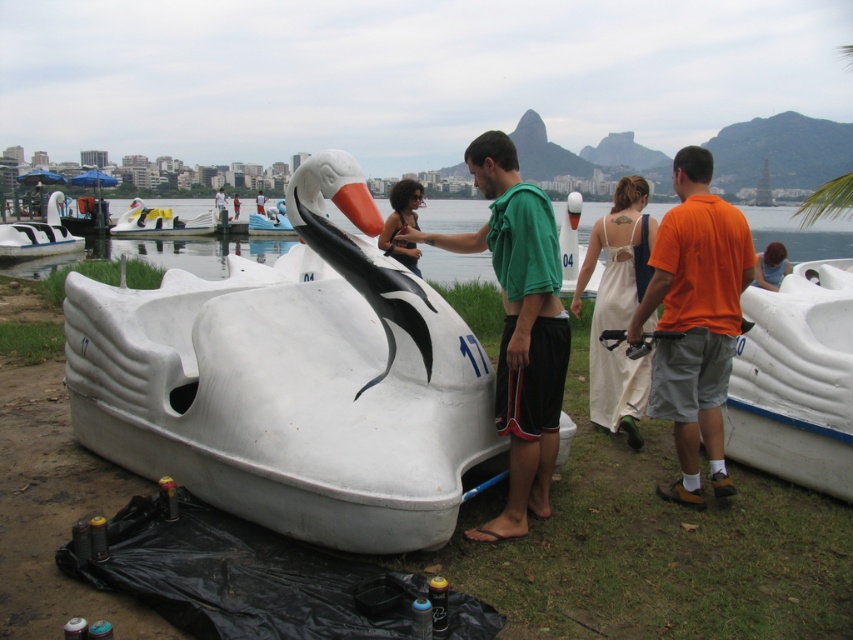
Can you confirm if green matte shirt at center is taller than white plastic swan at left?

In fact, green matte shirt at center may be shorter than white plastic swan at left.

Can you confirm if green matte shirt at center is thinner than white plastic swan at left?

Yes.

Is point (538, 326) in front of point (54, 211)?

That is True.

The height and width of the screenshot is (640, 853). Identify the location of green matte shirt at center. (518, 326).

Between green matte shirt at center and white matte swan boat at center, which one has less height?

white matte swan boat at center is shorter.

Can you confirm if green matte shirt at center is bigger than white matte swan boat at center?

No, green matte shirt at center is not bigger than white matte swan boat at center.

Between point (550, 248) and point (207, 220), which one is positioned in front?

Point (550, 248) is more forward.

At what (x,y) coordinates should I click in order to perform the action: click on green matte shirt at center. Please return your answer as a coordinate pair (x, y). The height and width of the screenshot is (640, 853). Looking at the image, I should click on (518, 326).

Does green matte shirt at center appear under white matte swan boat at right?

Yes, green matte shirt at center is below white matte swan boat at right.

Does green matte shirt at center appear on the right side of white matte swan boat at right?

In fact, green matte shirt at center is to the left of white matte swan boat at right.

Measure the distance between green matte shirt at center and camera.

4.02 meters

In order to click on green matte shirt at center in this screenshot , I will do `click(518, 326)`.